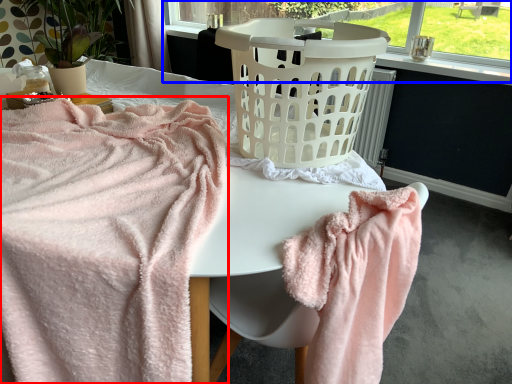
Question: Which of the following is the farthest to the observer, towel (highlighted by a red box) or bay window (highlighted by a blue box)?

Choices:
 (A) towel
 (B) bay window

Answer: (B)